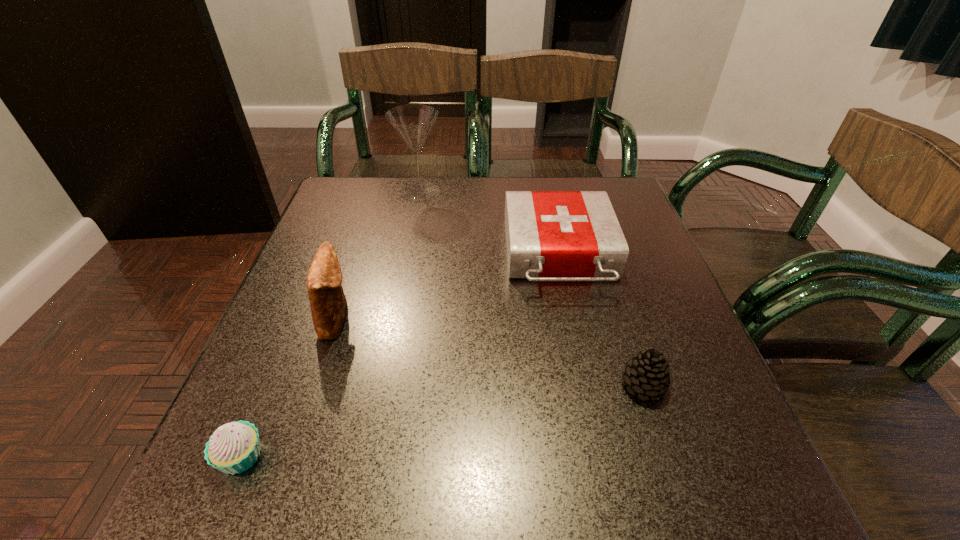
Find the location of a particular element. The height and width of the screenshot is (540, 960). the farthest object is located at coordinates (413, 122).

The image size is (960, 540). Identify the location of the third object from left to right. (413, 122).

The height and width of the screenshot is (540, 960). Identify the location of the fourth object from right to left. (328, 304).

Identify the location of the fourth shortest object. (328, 304).

Identify the location of pinecone. (648, 374).

I want to click on the first-aid kit, so click(550, 235).

Where is `cupcake`? cupcake is located at coordinates (234, 447).

This screenshot has width=960, height=540. In order to click on the nearest object in this screenshot , I will do `click(234, 447)`.

The image size is (960, 540). I want to click on free location located 0.360m on the right of the tallest object, so click(573, 192).

The height and width of the screenshot is (540, 960). I want to click on free space located 0.140m on the open side of the clutch bag, so click(x=422, y=319).